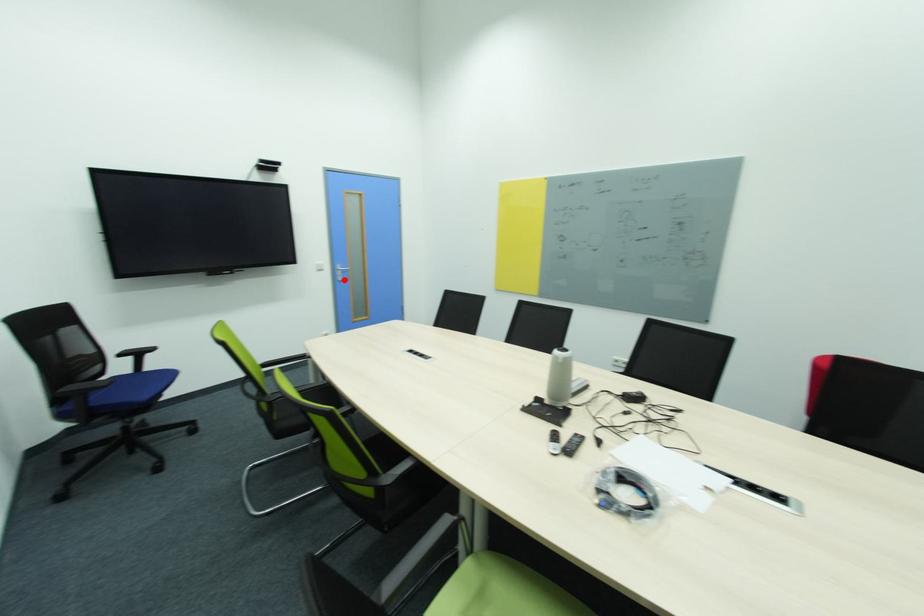
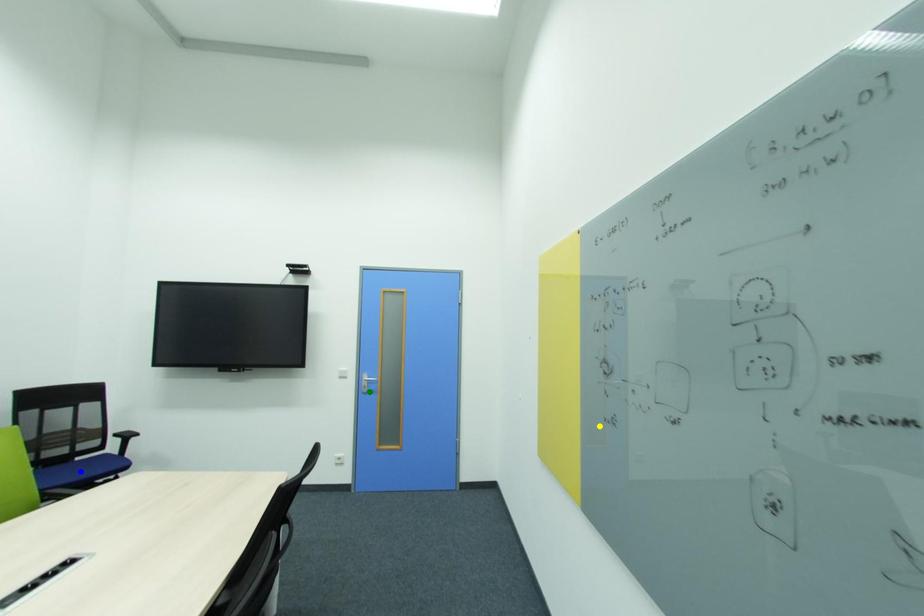
Question: I am providing you with two images of the same scene from different viewpoints. A red point is marked on the first image. You are given multiple points on the second image. Which mark in image 2 goes with the point in image 1?

Choices:
 (A) blue point
 (B) green point
 (C) yellow point

Answer: (B)